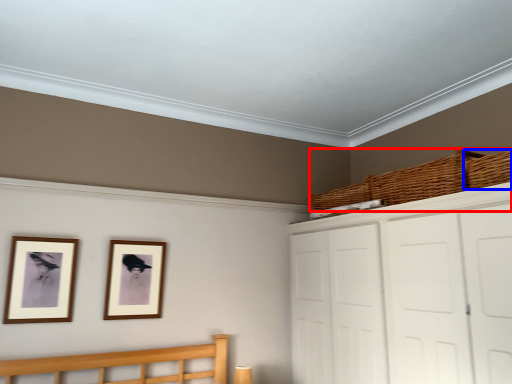
Question: Which object is closer to the camera taking this photo, basket (highlighted by a red box) or basket (highlighted by a blue box)?

Choices:
 (A) basket
 (B) basket

Answer: (B)